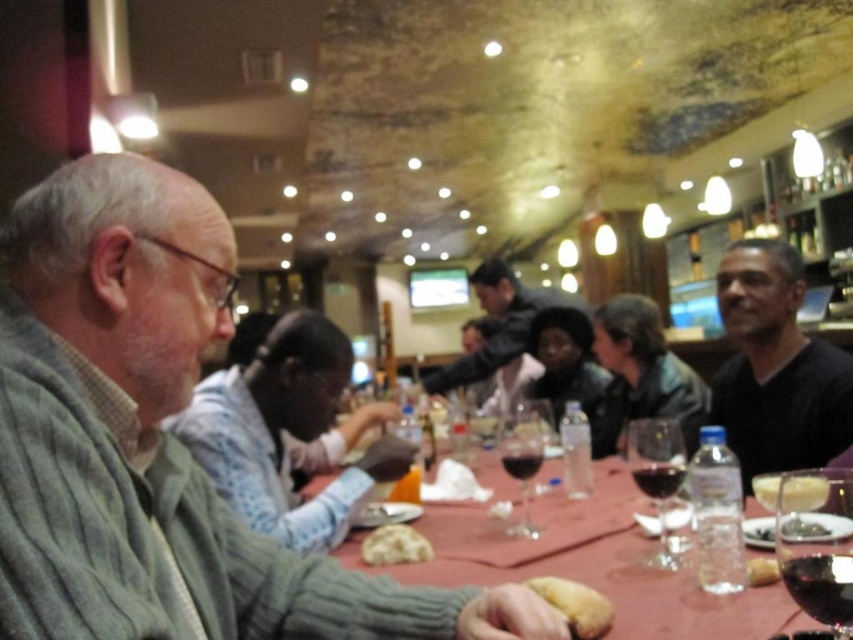
You are a waiter in the restaurant. You need to serve a customer who ordered a glass of wine. Which glass should you pick up first, the transparent glass wine at table center or the dark red glass at table center?

The transparent glass wine at table center is above the dark red glass at table center, so you should pick up the transparent glass wine at table center first to avoid disturbing the lower one.

You are standing at the point labeled as point (322, 332) in the image. You want to reach the entrance of the restaurant which is located at the opposite side of the room. The path to the entrance is 2.5 meters long. Can you walk straight from your current position to the entrance without needing to move around any obstacles?

The distance between you and the entrance is 2.5 meters, and since you are at point (322, 332) which is 1.68 meters away from the viewer, the total distance from the viewer to the entrance would be 1.68 meters plus 2.5 meters. However, the question states that the path to the entrance is 2.5 meters long. Since there are no obstacles mentioned in the scene description, you can walk straight to the entrance without needing to move around any obstacles.